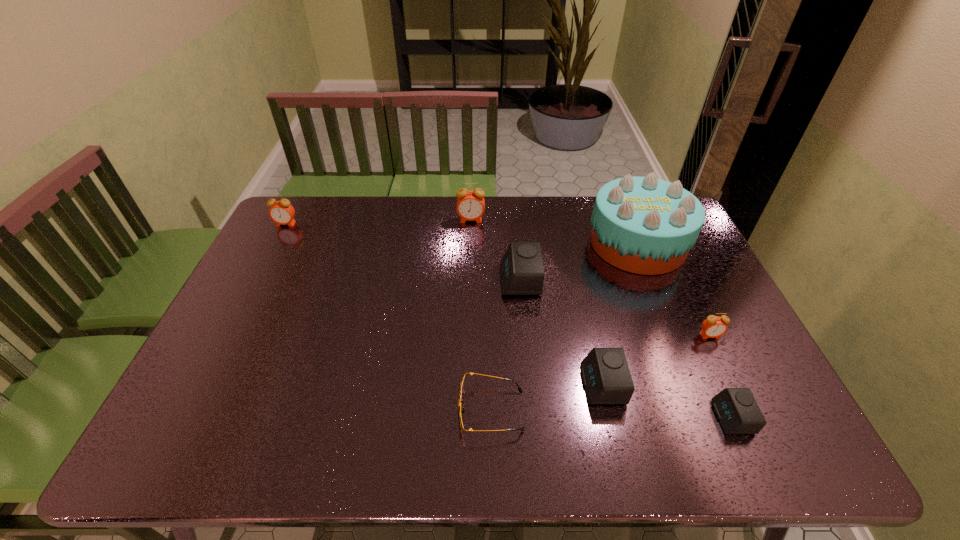
Find the location of a particular element. The height and width of the screenshot is (540, 960). object that is the fourth closest one to the cake is located at coordinates (470, 206).

Identify the location of object that can be found as the third closest to the cake. (606, 377).

Identify which alarm clock is the fourth nearest to the second biggest black alarm clock. Please provide its 2D coordinates. Your answer should be formatted as a tuple, i.e. [(x, y)], where the tuple contains the x and y coordinates of a point satisfying the conditions above.

[(470, 206)]

Locate an element on the screen. This screenshot has height=540, width=960. alarm clock that is the second nearest to the fourth farthest alarm clock is located at coordinates (606, 377).

Identify the location of pink alarm clock that is the second closest to the rightmost pink alarm clock. (281, 212).

Select which pink alarm clock appears as the closest to the biggest black alarm clock. Please provide its 2D coordinates. Your answer should be formatted as a tuple, i.e. [(x, y)], where the tuple contains the x and y coordinates of a point satisfying the conditions above.

[(470, 206)]

Identify which black alarm clock is located as the second nearest to the rightmost pink alarm clock. Please provide its 2D coordinates. Your answer should be formatted as a tuple, i.e. [(x, y)], where the tuple contains the x and y coordinates of a point satisfying the conditions above.

[(606, 377)]

This screenshot has height=540, width=960. Find the location of `black alarm clock that is the third closest to the cake`. black alarm clock that is the third closest to the cake is located at coordinates (737, 410).

This screenshot has height=540, width=960. I want to click on free space that satisfies the following two spatial constraints: 1. on the face of the cake; 2. on the right side of the biggest pink alarm clock, so click(470, 244).

Identify the location of vacant space that satisfies the following two spatial constraints: 1. on the face of the nearest pink alarm clock; 2. on the front-facing side of the rightmost black alarm clock. This screenshot has height=540, width=960. (749, 417).